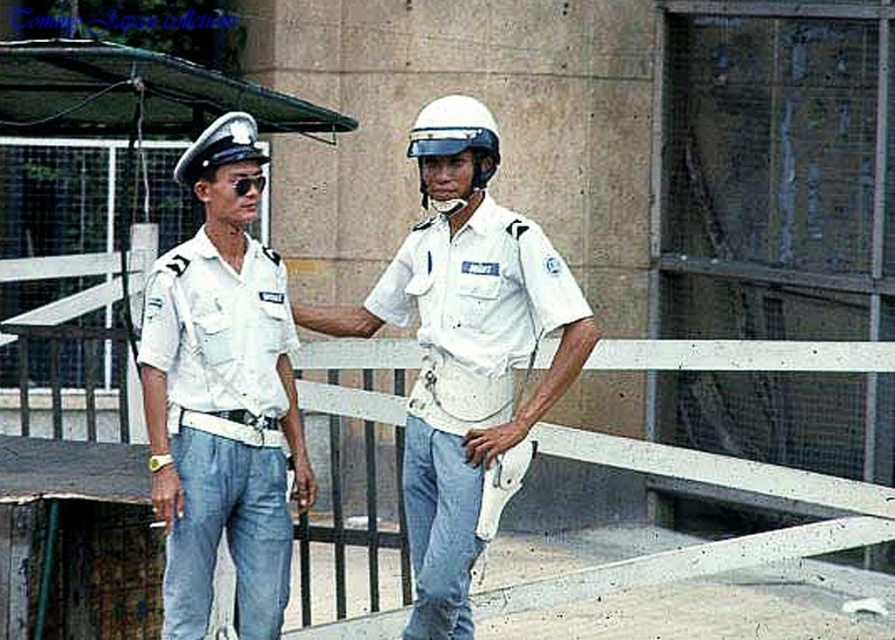
Question: Can you confirm if white matte uniform at center is positioned to the left of white cotton shirt at left?

Choices:
 (A) no
 (B) yes

Answer: (A)

Question: Is white matte uniform at center below white cotton shirt at left?

Choices:
 (A) no
 (B) yes

Answer: (A)

Question: Which object appears closest to the camera in this image?

Choices:
 (A) white matte helmet at center
 (B) white matte helmet at upper left

Answer: (B)

Question: Based on their relative distances, which object is nearer to the white matte helmet at upper left?

Choices:
 (A) white cotton shirt at left
 (B) white matte helmet at center
 (C) white matte uniform at center

Answer: (B)

Question: Does white matte uniform at center have a greater width compared to white matte helmet at center?

Choices:
 (A) no
 (B) yes

Answer: (B)

Question: Which object is positioned closest to the white matte helmet at upper left?

Choices:
 (A) white matte uniform at center
 (B) white matte helmet at center

Answer: (B)